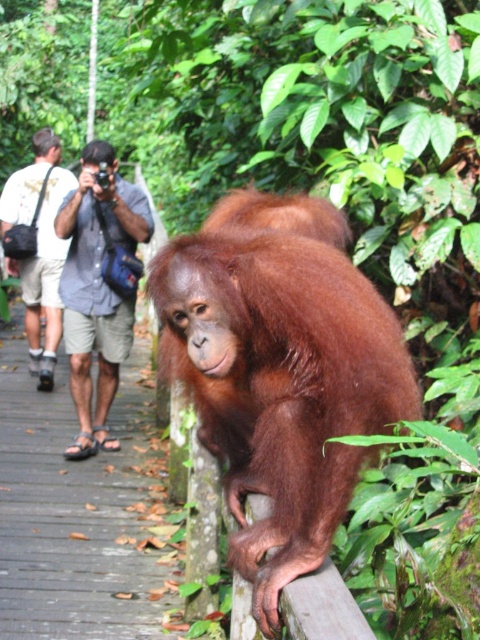
You are a photographer standing at the wooden boardwalk path. You want to take a photo of the orange fur orangutan at center and the blue denim shirt at upper left. Which one is positioned to the right side of the other?

The orange fur orangutan at center is positioned to the right of the blue denim shirt at upper left.

You are standing at the wooden railing where the orangutan is leaning. You want to take a photo of the two tourists walking on the boardwalk path. Which point, point (250, 452) or point (31, 204), is closer to you?

Point (250, 452) is closer to the viewer than point (31, 204), so you should focus on that point to capture the tourists in your photo.